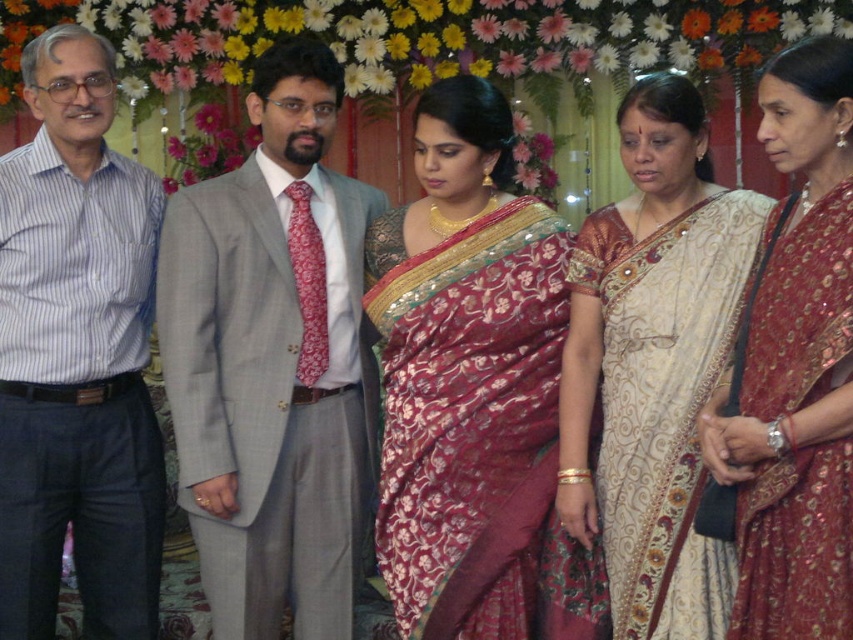
You are a photographer positioned in front of the group. You want to take a photo that includes both the light gray suit at center and the striped cotton shirt at left. Which of the two should you focus on first to ensure they are both in sharp focus?

The light gray suit at center is closer to you than the striped cotton shirt at left. To ensure both are in sharp focus, you should focus on the light gray suit at center first, as it is closer, and the striped cotton shirt at left will fall within the depth of field if focused properly.

You are a photographer preparing to take a group photo of the attendees. You need to ensure that the white silk saree at center and the shiny maroon saree at center are both visible in the frame. Considering their widths, which saree requires more space to accommodate its width in the photo?

The white silk saree at center has a greater width than the shiny maroon saree at center, so it requires more space to accommodate its width in the photo.

You are a photographer standing behind the group of people. You want to take a photo that includes both the light gray suit at center and the shiny maroon saree at center. The camera you are using has a maximum focus range of 4 feet. Can you capture both subjects in focus without moving the camera or the subjects?

The distance between the light gray suit at center and the shiny maroon saree at center is 4.27 feet. Since the camera can only focus within 4 feet, the subjects are slightly out of the focus range. Therefore, you cannot capture both in focus without adjusting the camera or moving the subjects.